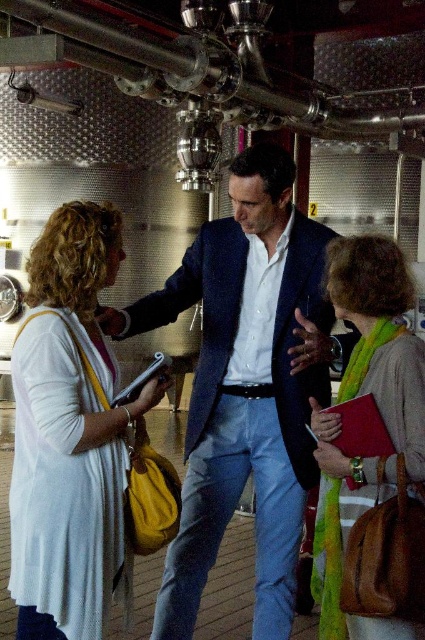
Question: Does red matte clipboard at center appear on the left side of matte yellow clipboard at center?

Choices:
 (A) no
 (B) yes

Answer: (A)

Question: Which object is closer to the camera taking this photo?

Choices:
 (A) light blue denim jeans at center
 (B) white knit cardigan at left
 (C) green scarf at center

Answer: (C)

Question: Which point is farther from the camera taking this photo?

Choices:
 (A) pyautogui.click(x=368, y=397)
 (B) pyautogui.click(x=254, y=467)
 (C) pyautogui.click(x=45, y=458)
 (D) pyautogui.click(x=379, y=291)

Answer: (B)

Question: Which object is the closest to the green scarf at center?

Choices:
 (A) matte yellow clipboard at center
 (B) light blue denim jeans at center
 (C) white knit cardigan at left
 (D) matte red notebook at center

Answer: (D)

Question: Does navy blue suit at center appear under matte red notebook at center?

Choices:
 (A) yes
 (B) no

Answer: (B)

Question: Is the position of light blue denim jeans at center more distant than that of matte yellow clipboard at center?

Choices:
 (A) yes
 (B) no

Answer: (A)